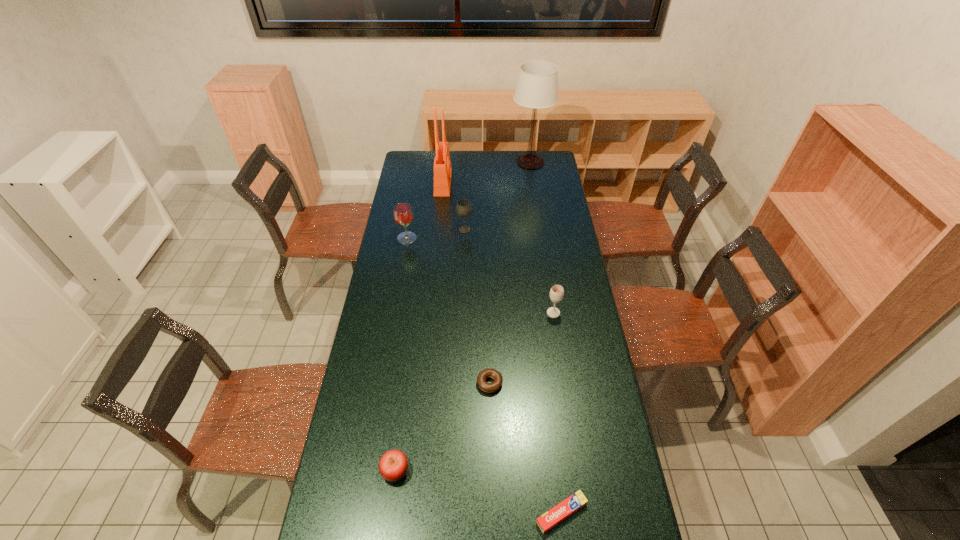
The height and width of the screenshot is (540, 960). In the image, there is a desktop. In order to click on free space at the far edge in this screenshot , I will do `click(466, 153)`.

In the image, there is a desktop. Identify the location of free space at the left edge. Image resolution: width=960 pixels, height=540 pixels. point(387,254).

The width and height of the screenshot is (960, 540). I want to click on vacant space at the right edge of the desktop, so click(596, 422).

In the image, there is a desktop. What are the coordinates of `free space at the far left corner` in the screenshot? It's located at (420, 173).

I want to click on free area in between the nearest object and the rightmost wineglass, so click(558, 413).

The height and width of the screenshot is (540, 960). Find the location of `free space that is in between the fifth object from right to left and the sixth tallest object`. free space that is in between the fifth object from right to left and the sixth tallest object is located at coordinates (430, 350).

The image size is (960, 540). Identify the location of unoccupied position between the table lamp and the shortest object. (546, 338).

At what (x,y) coordinates should I click in order to perform the action: click on vacant point located between the tallest object and the seventh shortest object. Please return your answer as a coordinate pair (x, y). Looking at the image, I should click on (487, 172).

At what (x,y) coordinates should I click in order to perform the action: click on unoccupied position between the second shortest object and the third shortest object. Please return your answer as a coordinate pair (x, y). This screenshot has width=960, height=540. Looking at the image, I should click on (443, 427).

At what (x,y) coordinates should I click in order to perform the action: click on vacant area that lies between the sixth tallest object and the shortest object. Please return your answer as a coordinate pair (x, y). Looking at the image, I should click on (478, 492).